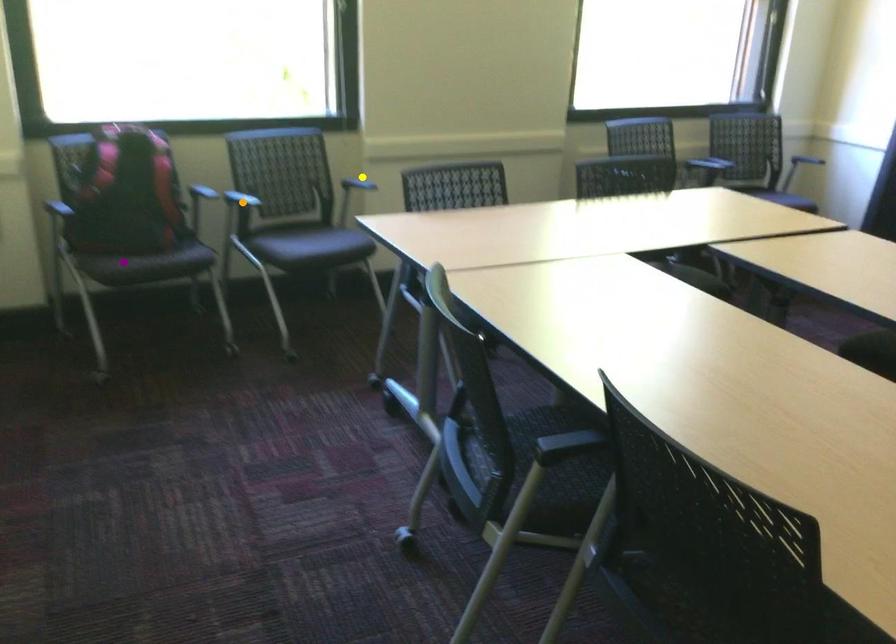
Order these from nearest to farthest:
orange point
yellow point
purple point

purple point
orange point
yellow point